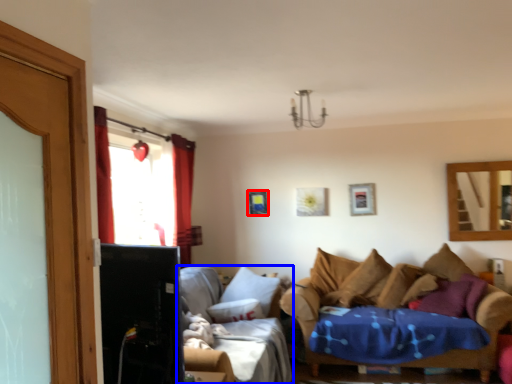
Question: Which of the following is the farthest to the observer, picture frame (highlighted by a red box) or studio couch (highlighted by a blue box)?

Choices:
 (A) picture frame
 (B) studio couch

Answer: (A)